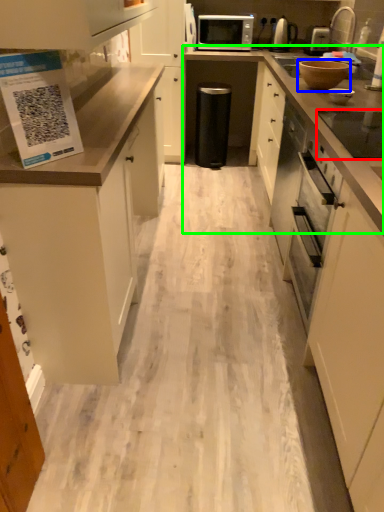
Question: Based on their relative distances, which object is nearer to appliance (highlighted by a red box)? Choose from appliance (highlighted by a blue box) and countertop (highlighted by a green box).

Choices:
 (A) appliance
 (B) countertop

Answer: (B)